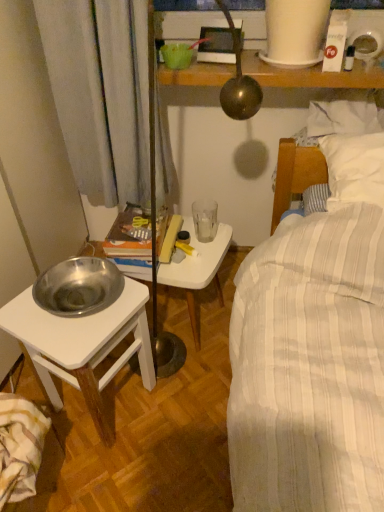
The height and width of the screenshot is (512, 384). What do you see at coordinates (197, 270) in the screenshot?
I see `white plastic table at center` at bounding box center [197, 270].

Measure the distance between point [3,441] and camera.

Point [3,441] is 98.80 centimeters from camera.

Describe the element at coordinates (82, 345) in the screenshot. The width and height of the screenshot is (384, 512). I see `silver metallic bowl at left` at that location.

The image size is (384, 512). Identify the location of white plastic table at center. (197, 270).

Looking at the image, does striped cotton blanket at lower left seem bigger or smaller compared to silver metallic bowl at left?

striped cotton blanket at lower left is smaller than silver metallic bowl at left.

Can you tell me how much striped cotton blanket at lower left and silver metallic bowl at left differ in facing direction?

There is a 27-degree angle between the facing directions of striped cotton blanket at lower left and silver metallic bowl at left.

Considering the sizes of objects striped cotton blanket at lower left and silver metallic bowl at left in the image provided, who is taller, striped cotton blanket at lower left or silver metallic bowl at left?

silver metallic bowl at left.

From a real-world perspective, which object rests below the other?

striped cotton blanket at lower left is physically lower.

Considering the relative positions of silver metallic bowl at left and white plastic table at center in the image provided, is silver metallic bowl at left to the left of white plastic table at center from the viewer's perspective?

Yes.

Can you confirm if silver metallic bowl at left is smaller than white plastic table at center?

No, silver metallic bowl at left is not smaller than white plastic table at center.

From the image's perspective, relative to white plastic table at center, is silver metallic bowl at left above or below?

Clearly, from the image's perspective, silver metallic bowl at left is below white plastic table at center.

From the image's perspective, who appears lower, transparent glass at center or silver metallic bowl at left?

silver metallic bowl at left appears lower in the image.

At what (x,y) coordinates should I click in order to perform the action: click on desk to the left of transparent glass at center. Please return your answer as a coordinate pair (x, y). This screenshot has height=512, width=384. Looking at the image, I should click on (82, 345).

Does transparent glass at center contain silver metallic bowl at left?

Definitely not — silver metallic bowl at left is not inside transparent glass at center.

Based on the photo, who is bigger, transparent glass at center or silver metallic bowl at left?

With larger size is silver metallic bowl at left.

Which is less distant, (192, 289) or (15, 337)?

Point (15, 337)

Is white plastic table at center at the left side of silver metallic bowl at left?

No.

From the image's perspective, which object appears higher, white plastic table at center or silver metallic bowl at left?

white plastic table at center.

Find the location of a particular element. desk above the white plastic table at center (from a real-world perspective) is located at coordinates (82, 345).

Is white plastic table at center beside transparent glass at center?

No, white plastic table at center is not in contact with transparent glass at center.

Considering the points (187, 218) and (214, 221), which point is behind, point (187, 218) or point (214, 221)?

Positioned behind is point (214, 221).

From a real-world perspective, between white plastic table at center and transparent glass at center, who is vertically higher?

From a 3D spatial view, transparent glass at center is above.

Would you consider transparent glass at center to be distant from striped cotton blanket at lower left?

No, there isn't a large distance between transparent glass at center and striped cotton blanket at lower left.

Can you confirm if transparent glass at center is smaller than striped cotton blanket at lower left?

Indeed, transparent glass at center has a smaller size compared to striped cotton blanket at lower left.

This screenshot has height=512, width=384. Find the location of `blanket that is under the transparent glass at center (from a real-world perspective)`. blanket that is under the transparent glass at center (from a real-world perspective) is located at coordinates (20, 447).

Is transparent glass at center situated inside striped cotton blanket at lower left or outside?

transparent glass at center is not inside striped cotton blanket at lower left, it's outside.

From the image's perspective, is striped cotton blanket at lower left above white plastic table at center?

Incorrect, from the image's perspective, striped cotton blanket at lower left is lower than white plastic table at center.

Find the location of a particular element. table located above the striped cotton blanket at lower left (from a real-world perspective) is located at coordinates (197, 270).

Is striped cotton blanket at lower left not inside white plastic table at center?

striped cotton blanket at lower left lies outside white plastic table at center's area.

Does striped cotton blanket at lower left touch white plastic table at center?

No.

Locate an element on the screen. This screenshot has height=512, width=384. desk behind the striped cotton blanket at lower left is located at coordinates (82, 345).

Locate an element on the screen. This screenshot has width=384, height=512. table located underneath the silver metallic bowl at left (from a real-world perspective) is located at coordinates (197, 270).

From the image, which object appears to be nearer to silver metallic bowl at left, striped cotton blanket at lower left or transparent glass at center?

The object closer to silver metallic bowl at left is striped cotton blanket at lower left.

Looking at the image, which one is located closer to transparent glass at center, silver metallic bowl at left or striped cotton blanket at lower left?

silver metallic bowl at left lies closer to transparent glass at center than the other object.

Considering their positions, is white plastic table at center positioned further to transparent glass at center than striped cotton blanket at lower left?

Based on the image, striped cotton blanket at lower left appears to be further to transparent glass at center.

From the image, which object appears to be farther from transparent glass at center, silver metallic bowl at left or white plastic table at center?

Among the two, silver metallic bowl at left is located further to transparent glass at center.

Looking at this image, looking at the image, which one is located closer to transparent glass at center, striped cotton blanket at lower left or silver metallic bowl at left?

Based on the image, silver metallic bowl at left appears to be nearer to transparent glass at center.

In the scene shown: Based on their spatial positions, is white plastic table at center or transparent glass at center closer to silver metallic bowl at left?

white plastic table at center is positioned closer to the anchor silver metallic bowl at left.

In the scene shown: From the image, which object appears to be nearer to transparent glass at center, white plastic table at center or silver metallic bowl at left?

white plastic table at center lies closer to transparent glass at center than the other object.

Which object lies further to the anchor point striped cotton blanket at lower left, white plastic table at center or transparent glass at center?

transparent glass at center lies further to striped cotton blanket at lower left than the other object.

Identify the location of desk located between striped cotton blanket at lower left and white plastic table at center in the left-right direction. Image resolution: width=384 pixels, height=512 pixels. (82, 345).

Identify the location of desk that lies between transparent glass at center and striped cotton blanket at lower left from top to bottom. (82, 345).

Find the location of a particular element. table between silver metallic bowl at left and transparent glass at center in the front-back direction is located at coordinates (197, 270).

Identify the location of table between transparent glass at center and striped cotton blanket at lower left from top to bottom. This screenshot has height=512, width=384. click(x=197, y=270).